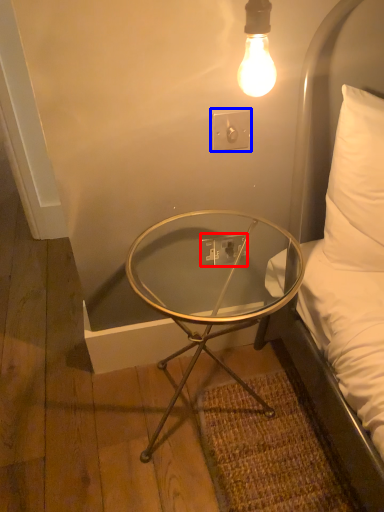
Question: Which of the following is the closest to the observer, electric outlet (highlighted by a red box) or electric outlet (highlighted by a blue box)?

Choices:
 (A) electric outlet
 (B) electric outlet

Answer: (B)